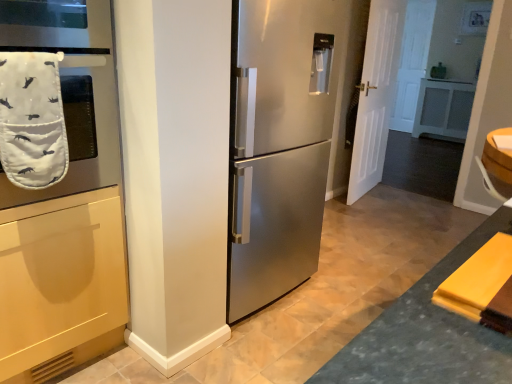
At what (x,y) coordinates should I click in order to perform the action: click on vacant space underneath white matte door at right (from a real-world perspective). Please return your answer as a coordinate pair (x, y). The image size is (512, 384). Looking at the image, I should click on (364, 195).